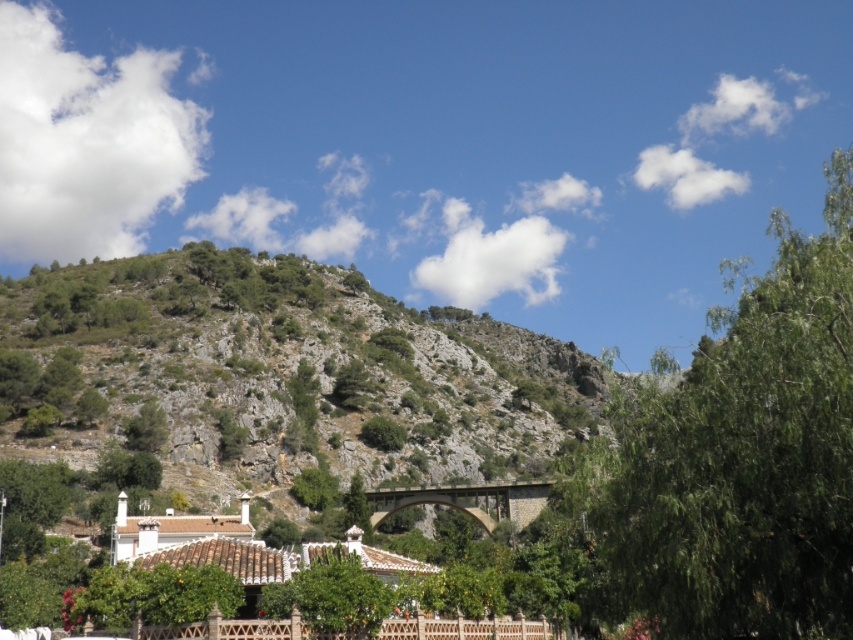
Question: Which object appears closest to the camera in this image?

Choices:
 (A) green leafy tree at upper right
 (B) green rocky hillside at upper left
 (C) green leafy tree at center

Answer: (A)

Question: Is green leafy tree at upper right bigger than green leafy tree at center?

Choices:
 (A) no
 (B) yes

Answer: (B)

Question: Is green rocky hillside at upper left wider than green leafy tree at center?

Choices:
 (A) no
 (B) yes

Answer: (B)

Question: Which point is farther from the camera taking this photo?

Choices:
 (A) (456, 371)
 (B) (848, 401)

Answer: (A)

Question: Is green rocky hillside at upper left positioned before green leafy tree at upper right?

Choices:
 (A) yes
 (B) no

Answer: (B)

Question: Which object is positioned farthest from the green leafy tree at center?

Choices:
 (A) green leafy tree at upper right
 (B) green rocky hillside at upper left

Answer: (B)